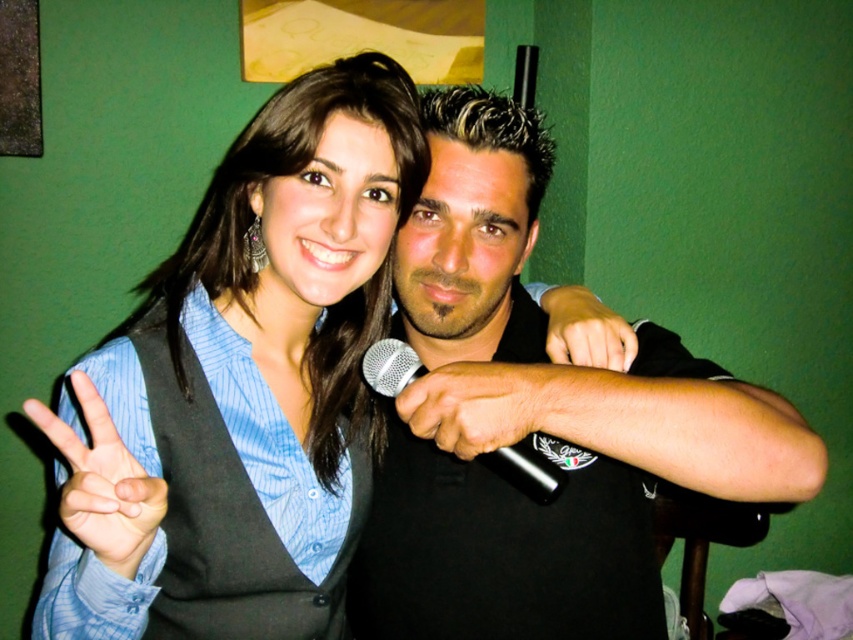
Question: Is blue striped shirt at center to the right of silver metallic microphone at center from the viewer's perspective?

Choices:
 (A) yes
 (B) no

Answer: (B)

Question: Among these objects, which one is nearest to the camera?

Choices:
 (A) blue fabric hand at center
 (B) black matte microphone at center

Answer: (A)

Question: Is blue striped shirt at center closer to camera compared to silver metallic microphone at center?

Choices:
 (A) yes
 (B) no

Answer: (A)

Question: Which object is the farthest from the silver metallic microphone at center?

Choices:
 (A) black matte vest at center
 (B) blue fabric hand at center
 (C) matte black fist at center
 (D) blue striped shirt at center

Answer: (B)

Question: Is blue fabric hand at center thinner than black matte microphone at center?

Choices:
 (A) no
 (B) yes

Answer: (B)

Question: Which object is farther from the camera taking this photo?

Choices:
 (A) black matte vest at center
 (B) blue striped shirt at center

Answer: (A)